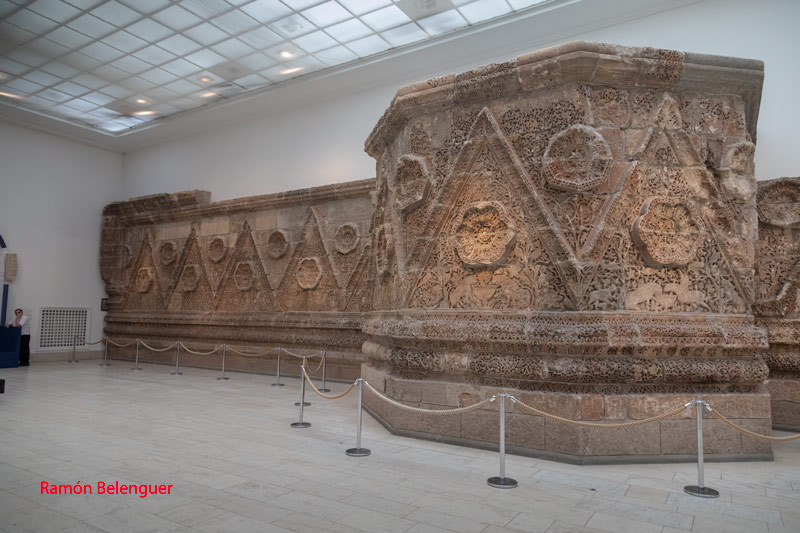
Where is `white wall`? Image resolution: width=800 pixels, height=533 pixels. white wall is located at coordinates (298, 134), (46, 156).